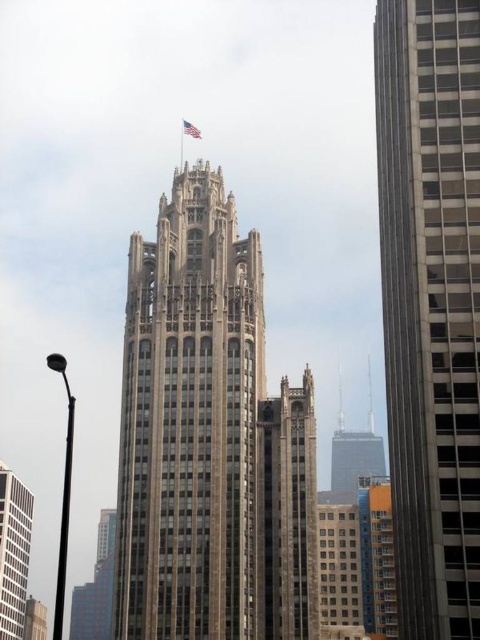
Is brown stone tower at center positioned before american flag at top?

Yes, brown stone tower at center is closer to the viewer.

Which is more to the right, brown stone tower at center or american flag at top?

brown stone tower at center is more to the right.

Is point (182, 577) positioned before point (192, 125)?

Yes, point (182, 577) is closer to viewer.

At what (x,y) coordinates should I click in order to perform the action: click on brown stone tower at center. Please return your answer as a coordinate pair (x, y). Image resolution: width=480 pixels, height=640 pixels. Looking at the image, I should click on (210, 440).

Between brown stone tower at center and white glass building at lower left, which one is positioned lower?

white glass building at lower left is below.

Can you confirm if brown stone tower at center is smaller than white glass building at lower left?

Incorrect, brown stone tower at center is not smaller in size than white glass building at lower left.

Is point (200, 276) positioned behind point (2, 524)?

No, it is in front of (2, 524).

At what (x,y) coordinates should I click in order to perform the action: click on brown stone tower at center. Please return your answer as a coordinate pair (x, y). The height and width of the screenshot is (640, 480). Looking at the image, I should click on (210, 440).

Can you confirm if brown stone skyscraper at right is taller than american flag at top?

Indeed, brown stone skyscraper at right has a greater height compared to american flag at top.

Is point (428, 454) farther from camera compared to point (189, 134)?

No.

Does point (451, 442) come farther from viewer compared to point (189, 122)?

No, (451, 442) is in front of (189, 122).

At what (x,y) coordinates should I click in order to perform the action: click on brown stone skyscraper at right. Please return your answer as a coordinate pair (x, y). Looking at the image, I should click on (431, 304).